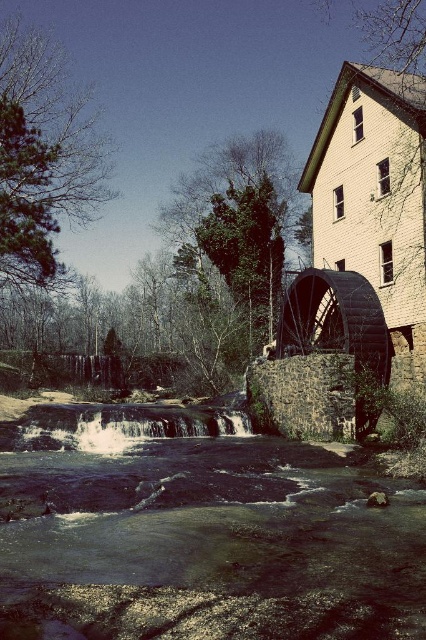
Which is in front, point (176, 564) or point (49, 412)?

Point (176, 564) is more forward.

Does dark blue water at center appear under white frothy water at lower center?

Incorrect, dark blue water at center is not positioned below white frothy water at lower center.

The width and height of the screenshot is (426, 640). Find the location of `dark blue water at center`. dark blue water at center is located at coordinates (198, 532).